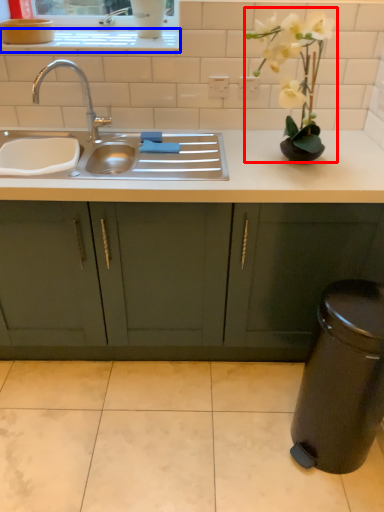
Question: Among these objects, which one is nearest to the camera, floral arrangement (highlighted by a red box) or window sill (highlighted by a blue box)?

Choices:
 (A) floral arrangement
 (B) window sill

Answer: (A)